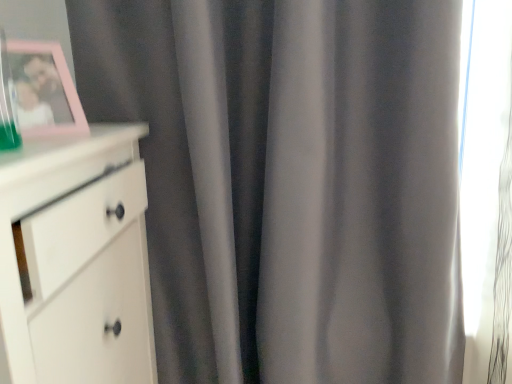
Question: From the image's perspective, is white matte chest of drawers at left located above pink plastic picture frame at upper left?

Choices:
 (A) yes
 (B) no

Answer: (B)

Question: Is the position of white matte chest of drawers at left more distant than that of pink plastic picture frame at upper left?

Choices:
 (A) yes
 (B) no

Answer: (B)

Question: From a real-world perspective, is white matte chest of drawers at left below pink plastic picture frame at upper left?

Choices:
 (A) no
 (B) yes

Answer: (B)

Question: Considering the relative sizes of white matte chest of drawers at left and pink plastic picture frame at upper left in the image provided, is white matte chest of drawers at left bigger than pink plastic picture frame at upper left?

Choices:
 (A) yes
 (B) no

Answer: (A)

Question: Can you confirm if white matte chest of drawers at left is taller than pink plastic picture frame at upper left?

Choices:
 (A) yes
 (B) no

Answer: (A)

Question: Can you see white matte chest of drawers at left touching pink plastic picture frame at upper left?

Choices:
 (A) yes
 (B) no

Answer: (B)

Question: Considering the relative sizes of pink plastic picture frame at upper left and white matte chest of drawers at left in the image provided, is pink plastic picture frame at upper left taller than white matte chest of drawers at left?

Choices:
 (A) no
 (B) yes

Answer: (A)

Question: Is pink plastic picture frame at upper left thinner than white matte chest of drawers at left?

Choices:
 (A) yes
 (B) no

Answer: (A)

Question: Is pink plastic picture frame at upper left positioned far away from white matte chest of drawers at left?

Choices:
 (A) no
 (B) yes

Answer: (A)

Question: From the image's perspective, is pink plastic picture frame at upper left on white matte chest of drawers at left?

Choices:
 (A) yes
 (B) no

Answer: (A)

Question: Is pink plastic picture frame at upper left shorter than white matte chest of drawers at left?

Choices:
 (A) no
 (B) yes

Answer: (B)

Question: From a real-world perspective, is pink plastic picture frame at upper left on top of white matte chest of drawers at left?

Choices:
 (A) yes
 (B) no

Answer: (A)

Question: Is pink plastic picture frame at upper left taller or shorter than white matte chest of drawers at left?

Choices:
 (A) tall
 (B) short

Answer: (B)